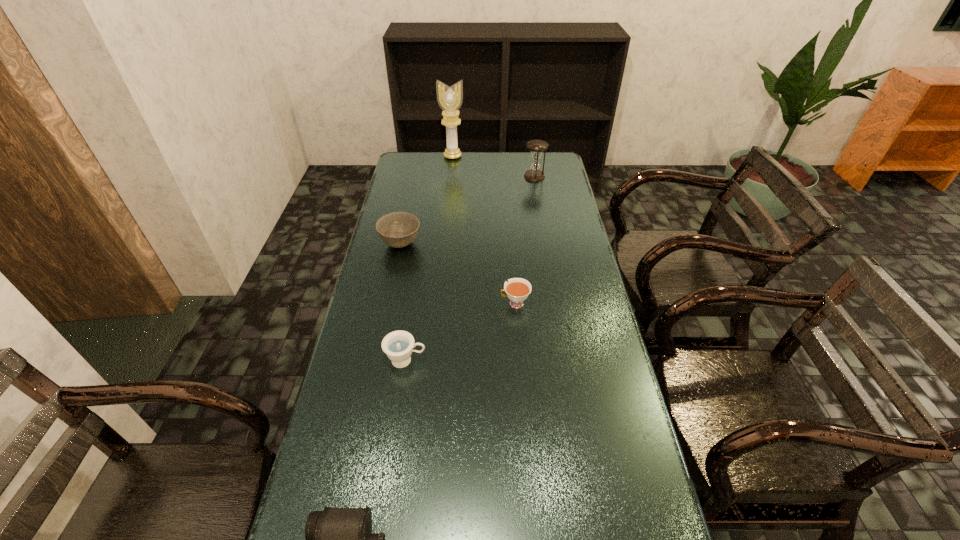
The image size is (960, 540). What are the coordinates of `free space located 0.130m on the front of the hourglass` in the screenshot? It's located at (539, 198).

The height and width of the screenshot is (540, 960). In order to click on free space located on the right of the fourth nearest object in this screenshot , I will do `click(451, 244)`.

Locate an element on the screen. free region located 0.330m on the side of the left teacup with the handle is located at coordinates (544, 361).

Find the location of a particular element. This screenshot has width=960, height=540. vacant space located 0.320m on the side of the right teacup with the handle is located at coordinates (398, 303).

You are a GUI agent. You are given a task and a screenshot of the screen. Output one action in this format:
    pyautogui.click(x=<x>, y=<y>)
    Task: Click on the free space located on the side of the right teacup with the handle
    
    Given the screenshot: What is the action you would take?
    pyautogui.click(x=480, y=303)

Find the location of `blank space located 0.100m on the side of the right teacup with the handle`. blank space located 0.100m on the side of the right teacup with the handle is located at coordinates (468, 303).

Where is `award present at the far edge`? award present at the far edge is located at coordinates (450, 99).

Image resolution: width=960 pixels, height=540 pixels. Identify the location of hourglass that is at the far edge. (534, 174).

The height and width of the screenshot is (540, 960). I want to click on bowl that is at the left edge, so click(398, 229).

This screenshot has width=960, height=540. In order to click on teacup that is positioned at the left edge in this screenshot , I will do `click(398, 345)`.